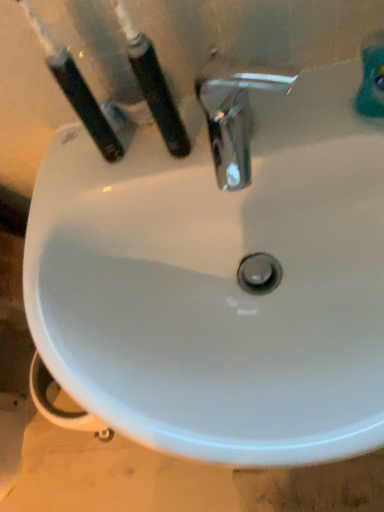
In order to click on black plastic toothbrush at upper left, acting as the 1th toothbrush starting from the left in this screenshot , I will do `click(76, 90)`.

Describe the element at coordinates (76, 90) in the screenshot. I see `black plastic toothbrush at upper left, acting as the 1th toothbrush starting from the left` at that location.

This screenshot has height=512, width=384. I want to click on black plastic toothbrush at upper left, the 1th toothbrush viewed from the right, so click(x=153, y=84).

What do you see at coordinates (153, 84) in the screenshot? I see `black plastic toothbrush at upper left, the 1th toothbrush viewed from the right` at bounding box center [153, 84].

You are a GUI agent. You are given a task and a screenshot of the screen. Output one action in this format:
    pyautogui.click(x=<x>, y=<y>)
    Task: Click on the black plastic toothbrush at upper left, acting as the 1th toothbrush starting from the left
    This screenshot has width=384, height=512.
    Given the screenshot: What is the action you would take?
    pyautogui.click(x=76, y=90)

Looking at this image, is black plastic toothbrush at upper left, the 1th toothbrush viewed from the right, to the left of black plastic toothbrush at upper left, positioned as the second toothbrush in right-to-left order, from the viewer's perspective?

No.

Relative to black plastic toothbrush at upper left, acting as the 1th toothbrush starting from the left, is black plastic toothbrush at upper left, the 1th toothbrush viewed from the right, in front or behind?

In the image, black plastic toothbrush at upper left, the 1th toothbrush viewed from the right, appears in front of black plastic toothbrush at upper left, acting as the 1th toothbrush starting from the left.

Which is less distant, (134, 63) or (53, 63)?

The point (53, 63) is closer.

From the image's perspective, is black plastic toothbrush at upper left, the 1th toothbrush viewed from the right, below black plastic toothbrush at upper left, acting as the 1th toothbrush starting from the left?

Correct, black plastic toothbrush at upper left, the 1th toothbrush viewed from the right, appears lower than black plastic toothbrush at upper left, acting as the 1th toothbrush starting from the left, in the image.

From a real-world perspective, which object rests below the other?

In real-world perspective, black plastic toothbrush at upper left, the 1th toothbrush viewed from the right, is lower.

Is black plastic toothbrush at upper left, the 1th toothbrush viewed from the right, wider than black plastic toothbrush at upper left, acting as the 1th toothbrush starting from the left?

Incorrect, the width of black plastic toothbrush at upper left, the 1th toothbrush viewed from the right, does not surpass that of black plastic toothbrush at upper left, acting as the 1th toothbrush starting from the left.

Between black plastic toothbrush at upper left, the 1th toothbrush viewed from the right, and black plastic toothbrush at upper left, positioned as the second toothbrush in right-to-left order, which one has more height?

With more height is black plastic toothbrush at upper left, positioned as the second toothbrush in right-to-left order.

From the picture: Is black plastic toothbrush at upper left, the second toothbrush viewed from the left, bigger or smaller than black plastic toothbrush at upper left, positioned as the second toothbrush in right-to-left order?

black plastic toothbrush at upper left, the second toothbrush viewed from the left, is smaller than black plastic toothbrush at upper left, positioned as the second toothbrush in right-to-left order.

Is black plastic toothbrush at upper left, positioned as the second toothbrush in right-to-left order, inside black plastic toothbrush at upper left, the 1th toothbrush viewed from the right?

No, black plastic toothbrush at upper left, positioned as the second toothbrush in right-to-left order, is not a part of black plastic toothbrush at upper left, the 1th toothbrush viewed from the right.

Are black plastic toothbrush at upper left, the second toothbrush viewed from the left, and black plastic toothbrush at upper left, acting as the 1th toothbrush starting from the left, beside each other?

Yes, black plastic toothbrush at upper left, the second toothbrush viewed from the left, is beside black plastic toothbrush at upper left, acting as the 1th toothbrush starting from the left.

Could you tell me if black plastic toothbrush at upper left, the second toothbrush viewed from the left, is facing black plastic toothbrush at upper left, acting as the 1th toothbrush starting from the left?

No, black plastic toothbrush at upper left, the second toothbrush viewed from the left, does not turn towards black plastic toothbrush at upper left, acting as the 1th toothbrush starting from the left.

Can you tell me how much black plastic toothbrush at upper left, the second toothbrush viewed from the left, and black plastic toothbrush at upper left, positioned as the second toothbrush in right-to-left order, differ in facing direction?

The angular difference between black plastic toothbrush at upper left, the second toothbrush viewed from the left, and black plastic toothbrush at upper left, positioned as the second toothbrush in right-to-left order, is 6.71 degrees.

Where is `toothbrush located underneath the black plastic toothbrush at upper left, positioned as the second toothbrush in right-to-left order (from a real-world perspective)`? The image size is (384, 512). toothbrush located underneath the black plastic toothbrush at upper left, positioned as the second toothbrush in right-to-left order (from a real-world perspective) is located at coordinates (153, 84).

Is black plastic toothbrush at upper left, acting as the 1th toothbrush starting from the left, at the left side of black plastic toothbrush at upper left, the second toothbrush viewed from the left?

Yes.

Considering the positions of objects black plastic toothbrush at upper left, positioned as the second toothbrush in right-to-left order, and black plastic toothbrush at upper left, the 1th toothbrush viewed from the right, in the image provided, who is behind, black plastic toothbrush at upper left, positioned as the second toothbrush in right-to-left order, or black plastic toothbrush at upper left, the 1th toothbrush viewed from the right,?

black plastic toothbrush at upper left, positioned as the second toothbrush in right-to-left order, is further away from the camera.

Is point (94, 117) closer or farther from the camera than point (170, 94)?

Point (94, 117) is positioned farther from the camera compared to point (170, 94).

From the image's perspective, which object appears higher, black plastic toothbrush at upper left, acting as the 1th toothbrush starting from the left, or black plastic toothbrush at upper left, the 1th toothbrush viewed from the right?

black plastic toothbrush at upper left, acting as the 1th toothbrush starting from the left, appears higher in the image.

From a real-world perspective, is black plastic toothbrush at upper left, acting as the 1th toothbrush starting from the left, physically above black plastic toothbrush at upper left, the second toothbrush viewed from the left?

Yes, from a real-world perspective, black plastic toothbrush at upper left, acting as the 1th toothbrush starting from the left, is above black plastic toothbrush at upper left, the second toothbrush viewed from the left.

Considering the sizes of black plastic toothbrush at upper left, positioned as the second toothbrush in right-to-left order, and black plastic toothbrush at upper left, the second toothbrush viewed from the left, in the image, is black plastic toothbrush at upper left, positioned as the second toothbrush in right-to-left order, wider or thinner than black plastic toothbrush at upper left, the second toothbrush viewed from the left,?

In the image, black plastic toothbrush at upper left, positioned as the second toothbrush in right-to-left order, appears to be wider than black plastic toothbrush at upper left, the second toothbrush viewed from the left.

From their relative heights in the image, would you say black plastic toothbrush at upper left, positioned as the second toothbrush in right-to-left order, is taller or shorter than black plastic toothbrush at upper left, the second toothbrush viewed from the left?

Clearly, black plastic toothbrush at upper left, positioned as the second toothbrush in right-to-left order, is taller compared to black plastic toothbrush at upper left, the second toothbrush viewed from the left.

Can you confirm if black plastic toothbrush at upper left, positioned as the second toothbrush in right-to-left order, is smaller than black plastic toothbrush at upper left, the second toothbrush viewed from the left?

No, black plastic toothbrush at upper left, positioned as the second toothbrush in right-to-left order, is not smaller than black plastic toothbrush at upper left, the second toothbrush viewed from the left.

Is black plastic toothbrush at upper left, positioned as the second toothbrush in right-to-left order, inside the boundaries of black plastic toothbrush at upper left, the second toothbrush viewed from the left, or outside?

black plastic toothbrush at upper left, positioned as the second toothbrush in right-to-left order, is not enclosed by black plastic toothbrush at upper left, the second toothbrush viewed from the left.

In the scene shown: Would you consider black plastic toothbrush at upper left, positioned as the second toothbrush in right-to-left order, to be distant from black plastic toothbrush at upper left, the second toothbrush viewed from the left?

Actually, black plastic toothbrush at upper left, positioned as the second toothbrush in right-to-left order, and black plastic toothbrush at upper left, the second toothbrush viewed from the left, are a little close together.

Consider the image. Is black plastic toothbrush at upper left, acting as the 1th toothbrush starting from the left, turned away from black plastic toothbrush at upper left, the 1th toothbrush viewed from the right?

black plastic toothbrush at upper left, acting as the 1th toothbrush starting from the left, is not turned away from black plastic toothbrush at upper left, the 1th toothbrush viewed from the right.

The width and height of the screenshot is (384, 512). I want to click on toothbrush above the black plastic toothbrush at upper left, the 1th toothbrush viewed from the right (from a real-world perspective), so click(x=76, y=90).

Where is `toothbrush behind the black plastic toothbrush at upper left, the 1th toothbrush viewed from the right`? This screenshot has width=384, height=512. toothbrush behind the black plastic toothbrush at upper left, the 1th toothbrush viewed from the right is located at coordinates click(x=76, y=90).

Where is `toothbrush located on the right of black plastic toothbrush at upper left, positioned as the second toothbrush in right-to-left order`? toothbrush located on the right of black plastic toothbrush at upper left, positioned as the second toothbrush in right-to-left order is located at coordinates (153, 84).